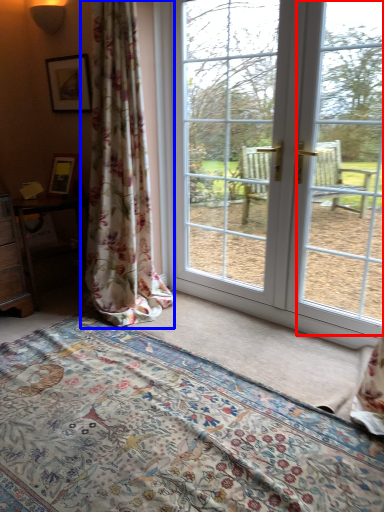
Question: Among these objects, which one is farthest to the camera, window screen (highlighted by a red box) or curtain (highlighted by a blue box)?

Choices:
 (A) window screen
 (B) curtain

Answer: (B)